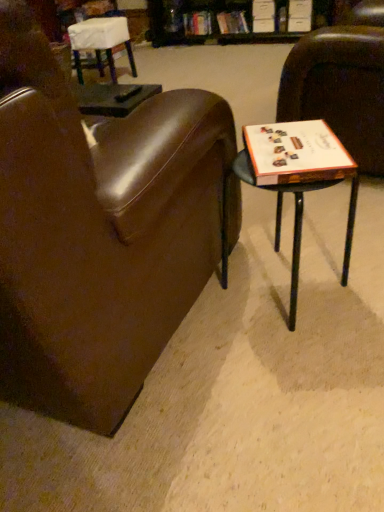
Question: Is wooden table at right positioned far away from white paper at right?

Choices:
 (A) no
 (B) yes

Answer: (A)

Question: Is wooden table at right at the right side of white paper at right?

Choices:
 (A) no
 (B) yes

Answer: (B)

Question: Can you confirm if wooden table at right is taller than white paper at right?

Choices:
 (A) yes
 (B) no

Answer: (A)

Question: Can you confirm if wooden table at right is smaller than white paper at right?

Choices:
 (A) no
 (B) yes

Answer: (A)

Question: Is wooden table at right bigger than white paper at right?

Choices:
 (A) no
 (B) yes

Answer: (B)

Question: From a real-world perspective, is wooden table at right under white paper at right?

Choices:
 (A) no
 (B) yes

Answer: (B)

Question: Would you say brown leather chair at right, which is the second chair from back to front, contains white paper at right?

Choices:
 (A) yes
 (B) no

Answer: (B)

Question: Is brown leather chair at right, which is the second chair from back to front, facing towards white paper at right?

Choices:
 (A) yes
 (B) no

Answer: (B)

Question: Is brown leather chair at right, the first chair in the right-to-left sequence, turned away from white paper at right?

Choices:
 (A) yes
 (B) no

Answer: (B)

Question: Considering the relative sizes of brown leather chair at right, which ranks as the second chair in front-to-back order, and white paper at right in the image provided, is brown leather chair at right, which ranks as the second chair in front-to-back order, shorter than white paper at right?

Choices:
 (A) no
 (B) yes

Answer: (A)

Question: Can you see brown leather chair at right, the first chair in the right-to-left sequence, touching white paper at right?

Choices:
 (A) yes
 (B) no

Answer: (B)

Question: From a real-world perspective, does brown leather chair at right, the 3th chair positioned from the left, sit lower than white paper at right?

Choices:
 (A) no
 (B) yes

Answer: (B)

Question: Is brown leather chair at center, which ranks as the third chair in back-to-front order, positioned before white fabric-covered chair at upper left, positioned as the third chair in front-to-back order?

Choices:
 (A) no
 (B) yes

Answer: (B)